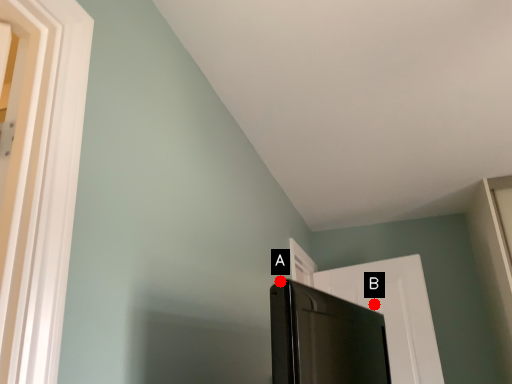
Question: Two points are circled on the image, labeled by A and B beside each circle. Which point is further to the camera?

Choices:
 (A) A is further
 (B) B is further

Answer: (B)